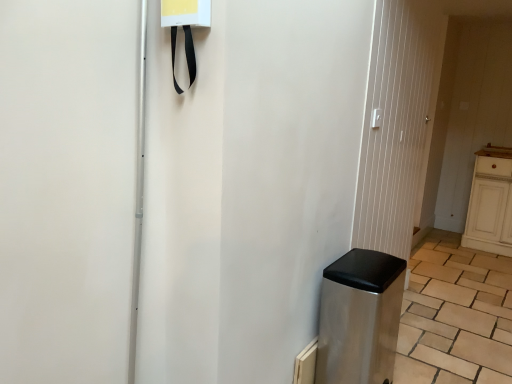
Question: Is stainless steel trash can at lower right taller than metallic silver screen door at center?

Choices:
 (A) no
 (B) yes

Answer: (A)

Question: Is stainless steel trash can at lower right in contact with metallic silver screen door at center?

Choices:
 (A) yes
 (B) no

Answer: (B)

Question: Considering the relative sizes of stainless steel trash can at lower right and metallic silver screen door at center in the image provided, is stainless steel trash can at lower right smaller than metallic silver screen door at center?

Choices:
 (A) no
 (B) yes

Answer: (B)

Question: Is stainless steel trash can at lower right aimed at metallic silver screen door at center?

Choices:
 (A) yes
 (B) no

Answer: (B)

Question: Is the position of stainless steel trash can at lower right more distant than that of metallic silver screen door at center?

Choices:
 (A) no
 (B) yes

Answer: (A)

Question: From the image's perspective, relative to metallic silver screen door at center, is stainless steel trash can at lower right above or below?

Choices:
 (A) below
 (B) above

Answer: (A)

Question: In the image, is stainless steel trash can at lower right on the left side or the right side of metallic silver screen door at center?

Choices:
 (A) right
 (B) left

Answer: (B)

Question: Considering the positions of stainless steel trash can at lower right and metallic silver screen door at center in the image, is stainless steel trash can at lower right taller or shorter than metallic silver screen door at center?

Choices:
 (A) short
 (B) tall

Answer: (A)

Question: Is stainless steel trash can at lower right in front of or behind metallic silver screen door at center in the image?

Choices:
 (A) front
 (B) behind

Answer: (A)

Question: From the image's perspective, relative to stainless steel trash can at lower right, is brown wooden counter top at right above or below?

Choices:
 (A) above
 (B) below

Answer: (A)

Question: Considering their positions, is brown wooden counter top at right located in front of or behind stainless steel trash can at lower right?

Choices:
 (A) behind
 (B) front

Answer: (A)

Question: Based on their sizes in the image, would you say brown wooden counter top at right is bigger or smaller than stainless steel trash can at lower right?

Choices:
 (A) big
 (B) small

Answer: (B)

Question: Is brown wooden counter top at right taller or shorter than stainless steel trash can at lower right?

Choices:
 (A) tall
 (B) short

Answer: (B)

Question: In terms of size, does stainless steel trash can at lower right appear bigger or smaller than brown wooden counter top at right?

Choices:
 (A) small
 (B) big

Answer: (B)

Question: Considering the positions of stainless steel trash can at lower right and brown wooden counter top at right in the image, is stainless steel trash can at lower right wider or thinner than brown wooden counter top at right?

Choices:
 (A) wide
 (B) thin

Answer: (A)